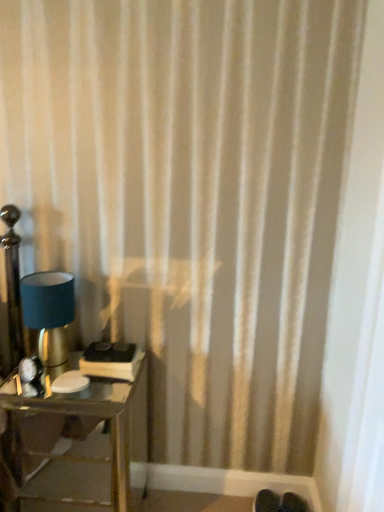
Question: From a real-world perspective, is metallic glass table at lower left located higher than matte blue fabric lampshade at left?

Choices:
 (A) no
 (B) yes

Answer: (A)

Question: From a real-world perspective, is metallic glass table at lower left under matte blue fabric lampshade at left?

Choices:
 (A) yes
 (B) no

Answer: (A)

Question: Could you tell me if metallic glass table at lower left is turned towards matte blue fabric lampshade at left?

Choices:
 (A) no
 (B) yes

Answer: (A)

Question: Is metallic glass table at lower left oriented away from matte blue fabric lampshade at left?

Choices:
 (A) yes
 (B) no

Answer: (B)

Question: Does metallic glass table at lower left have a lesser height compared to matte blue fabric lampshade at left?

Choices:
 (A) no
 (B) yes

Answer: (A)

Question: Can you confirm if metallic glass table at lower left is taller than matte blue fabric lampshade at left?

Choices:
 (A) yes
 (B) no

Answer: (A)

Question: From a real-world perspective, is matte blue fabric lampshade at left on metallic glass table at lower left?

Choices:
 (A) no
 (B) yes

Answer: (B)

Question: Is matte blue fabric lampshade at left next to metallic glass table at lower left?

Choices:
 (A) yes
 (B) no

Answer: (B)

Question: Is matte blue fabric lampshade at left looking in the opposite direction of metallic glass table at lower left?

Choices:
 (A) yes
 (B) no

Answer: (B)

Question: From a real-world perspective, is matte blue fabric lampshade at left physically below metallic glass table at lower left?

Choices:
 (A) no
 (B) yes

Answer: (A)

Question: Is matte blue fabric lampshade at left to the left of metallic glass table at lower left from the viewer's perspective?

Choices:
 (A) yes
 (B) no

Answer: (A)

Question: Is matte blue fabric lampshade at left bigger than metallic glass table at lower left?

Choices:
 (A) no
 (B) yes

Answer: (A)

Question: Is point (34, 304) positioned closer to the camera than point (16, 462)?

Choices:
 (A) farther
 (B) closer

Answer: (B)